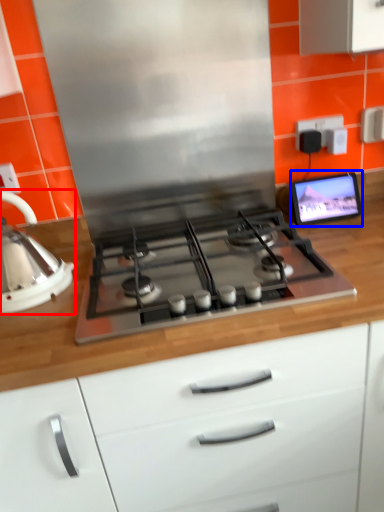
Question: Which object appears farthest to the camera in this image, kitchen appliance (highlighted by a red box) or computer monitor (highlighted by a blue box)?

Choices:
 (A) kitchen appliance
 (B) computer monitor

Answer: (B)